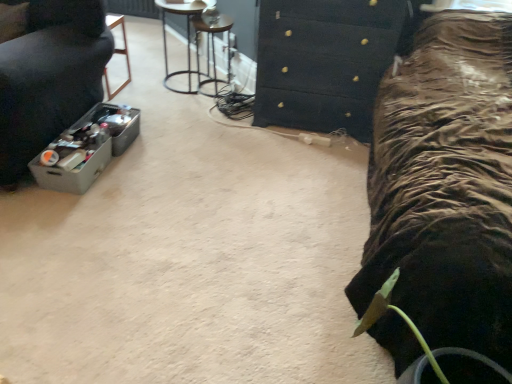
The image size is (512, 384). Describe the element at coordinates (214, 52) in the screenshot. I see `metallic wireframe stool at upper center` at that location.

Where is `metallic wireframe stool at upper center`? The height and width of the screenshot is (384, 512). metallic wireframe stool at upper center is located at coordinates (214, 52).

Where is `black textured chest of drawers at upper center`? The width and height of the screenshot is (512, 384). black textured chest of drawers at upper center is located at coordinates (326, 61).

Identify the location of gray plastic container at left, placed as the 2th furniture when sorted from right to left. (47, 75).

In order to click on the chest of drawers above the gray plastic container at left, placed as the 2th furniture when sorted from right to left (from the image's perspective) in this screenshot , I will do `click(326, 61)`.

Is black textured chest of drawers at upper center closer to the viewer compared to gray plastic container at left, which is the first furniture from left to right?

No, it is behind gray plastic container at left, which is the first furniture from left to right.

How different are the orientations of black textured chest of drawers at upper center and gray plastic container at left, the second furniture from the back, in degrees?

1.85 degrees.

Considering the sizes of objects black textured chest of drawers at upper center and gray plastic container at left, the second furniture from the back, in the image provided, who is thinner, black textured chest of drawers at upper center or gray plastic container at left, the second furniture from the back,?

black textured chest of drawers at upper center is thinner.

In the scene shown: Is black textured chest of drawers at upper center taller than metallic wire side table at upper center, which ranks as the second furniture in front-to-back order?

Yes, black textured chest of drawers at upper center is taller than metallic wire side table at upper center, which ranks as the second furniture in front-to-back order.

Would you consider black textured chest of drawers at upper center to be distant from metallic wire side table at upper center, the 1th furniture from the right?

black textured chest of drawers at upper center is far away from metallic wire side table at upper center, the 1th furniture from the right.

Considering the points (273, 75) and (176, 4), which point is behind, point (273, 75) or point (176, 4)?

Positioned behind is point (176, 4).

Where is `the chest of drawers located above the metallic wire side table at upper center, which ranks as the second furniture in front-to-back order (from a real-world perspective)`? The image size is (512, 384). the chest of drawers located above the metallic wire side table at upper center, which ranks as the second furniture in front-to-back order (from a real-world perspective) is located at coordinates (326, 61).

From the image's perspective, would you say black textured chest of drawers at upper center is shown under metallic wireframe stool at upper center?

Indeed, from the image's perspective, black textured chest of drawers at upper center is shown beneath metallic wireframe stool at upper center.

Which is farther from the camera, (308, 17) or (222, 90)?

Positioned behind is point (222, 90).

Is black textured chest of drawers at upper center bigger or smaller than metallic wireframe stool at upper center?

black textured chest of drawers at upper center is bigger than metallic wireframe stool at upper center.

Is metallic wireframe stool at upper center positioned far away from black textured chest of drawers at upper center?

No, metallic wireframe stool at upper center is not far away from black textured chest of drawers at upper center.

Consider the image. Can you tell me how much metallic wireframe stool at upper center and black textured chest of drawers at upper center differ in facing direction?

They differ by 0.709 degrees in their facing directions.

Based on the photo, between metallic wireframe stool at upper center and black textured chest of drawers at upper center, which one is positioned behind?

metallic wireframe stool at upper center.

Which of these two, metallic wireframe stool at upper center or black textured chest of drawers at upper center, is bigger?

Bigger between the two is black textured chest of drawers at upper center.

From a real-world perspective, is metallic wire side table at upper center, the 1th furniture from the right, positioned above or below metallic wireframe stool at upper center?

metallic wire side table at upper center, the 1th furniture from the right, is situated higher than metallic wireframe stool at upper center in the real world.

Identify the location of bar stool below the metallic wire side table at upper center, acting as the 1th furniture starting from the back (from a real-world perspective). (214, 52).

Considering the relative positions of metallic wire side table at upper center, which ranks as the second furniture in front-to-back order, and metallic wireframe stool at upper center in the image provided, is metallic wire side table at upper center, which ranks as the second furniture in front-to-back order, to the left of metallic wireframe stool at upper center from the viewer's perspective?

Indeed, metallic wire side table at upper center, which ranks as the second furniture in front-to-back order, is positioned on the left side of metallic wireframe stool at upper center.

Is metallic wireframe stool at upper center positioned with its back to metallic wire side table at upper center, the 1th furniture from the right?

No, metallic wireframe stool at upper center is not facing the opposite direction of metallic wire side table at upper center, the 1th furniture from the right.

Can you confirm if metallic wireframe stool at upper center is positioned to the right of metallic wire side table at upper center, the 1th furniture from the right?

Indeed, metallic wireframe stool at upper center is positioned on the right side of metallic wire side table at upper center, the 1th furniture from the right.

Considering the sizes of metallic wireframe stool at upper center and metallic wire side table at upper center, acting as the 1th furniture starting from the back, in the image, is metallic wireframe stool at upper center wider or thinner than metallic wire side table at upper center, acting as the 1th furniture starting from the back,?

metallic wireframe stool at upper center is wider than metallic wire side table at upper center, acting as the 1th furniture starting from the back.

Is metallic wire side table at upper center, the 1th furniture from the right, completely or partially inside metallic wireframe stool at upper center?

Yes, metallic wire side table at upper center, the 1th furniture from the right, is surrounded by metallic wireframe stool at upper center.

Which of these two, metallic wireframe stool at upper center or gray plastic container at left, which is the first furniture from left to right, is bigger?

With larger size is gray plastic container at left, which is the first furniture from left to right.

Is metallic wireframe stool at upper center further to the viewer compared to gray plastic container at left, placed as the 2th furniture when sorted from right to left?

Yes, it is behind gray plastic container at left, placed as the 2th furniture when sorted from right to left.

Is metallic wireframe stool at upper center in contact with gray plastic container at left, the second furniture from the back?

No, metallic wireframe stool at upper center is not in contact with gray plastic container at left, the second furniture from the back.

Measure the distance from metallic wireframe stool at upper center to gray plastic container at left, the second furniture from the back.

metallic wireframe stool at upper center is 1.03 meters from gray plastic container at left, the second furniture from the back.

Find the location of a particular element. The width and height of the screenshot is (512, 384). chest of drawers below the gray plastic container at left, which is the first furniture from left to right (from a real-world perspective) is located at coordinates (326, 61).

Where is `chest of drawers above the metallic wire side table at upper center, the 1th furniture from the right (from a real-world perspective)`? chest of drawers above the metallic wire side table at upper center, the 1th furniture from the right (from a real-world perspective) is located at coordinates pos(326,61).

Looking at the image, which one is located further to black textured chest of drawers at upper center, metallic wire side table at upper center, the 1th furniture from the right, or gray plastic container at left, the second furniture from the back?

gray plastic container at left, the second furniture from the back, is positioned further to the anchor black textured chest of drawers at upper center.

Looking at the image, which one is located closer to gray plastic container at left, the second furniture from the back, metallic wireframe stool at upper center or metallic wire side table at upper center, arranged as the 2th furniture when viewed from the left?

metallic wireframe stool at upper center is positioned closer to the anchor gray plastic container at left, the second furniture from the back.

When comparing their distances from metallic wire side table at upper center, the 1th furniture from the right, does black textured chest of drawers at upper center or gray plastic container at left, the second furniture from the back, seem closer?

Among the two, black textured chest of drawers at upper center is located nearer to metallic wire side table at upper center, the 1th furniture from the right.

Looking at the image, which one is located closer to metallic wireframe stool at upper center, metallic wire side table at upper center, acting as the 1th furniture starting from the back, or gray plastic container at left, which ranks as the first furniture in front-to-back order?

Based on the image, metallic wire side table at upper center, acting as the 1th furniture starting from the back, appears to be nearer to metallic wireframe stool at upper center.

Looking at this image, based on their spatial positions, is metallic wire side table at upper center, arranged as the 2th furniture when viewed from the left, or metallic wireframe stool at upper center further from gray plastic container at left, which is the first furniture from left to right?

Among the two, metallic wire side table at upper center, arranged as the 2th furniture when viewed from the left, is located further to gray plastic container at left, which is the first furniture from left to right.

Considering their positions, is gray plastic container at left, which ranks as the first furniture in front-to-back order, positioned further to black textured chest of drawers at upper center than metallic wire side table at upper center, arranged as the 2th furniture when viewed from the left?

gray plastic container at left, which ranks as the first furniture in front-to-back order, lies further to black textured chest of drawers at upper center than the other object.

Estimate the real-world distances between objects in this image. Which object is closer to metallic wireframe stool at upper center, metallic wire side table at upper center, arranged as the 2th furniture when viewed from the left, or black textured chest of drawers at upper center?

metallic wire side table at upper center, arranged as the 2th furniture when viewed from the left.

Looking at this image, based on their spatial positions, is gray plastic container at left, the second furniture from the back, or metallic wire side table at upper center, which ranks as the second furniture in front-to-back order, further from metallic wireframe stool at upper center?

gray plastic container at left, the second furniture from the back, is positioned further to the anchor metallic wireframe stool at upper center.

Image resolution: width=512 pixels, height=384 pixels. Find the location of `furniture between gray plastic container at left, which ranks as the first furniture in front-to-back order, and metallic wireframe stool at upper center from front to back`. furniture between gray plastic container at left, which ranks as the first furniture in front-to-back order, and metallic wireframe stool at upper center from front to back is located at coordinates (187, 38).

Where is `bar stool between metallic wire side table at upper center, which ranks as the second furniture in front-to-back order, and black textured chest of drawers at upper center from left to right`? The height and width of the screenshot is (384, 512). bar stool between metallic wire side table at upper center, which ranks as the second furniture in front-to-back order, and black textured chest of drawers at upper center from left to right is located at coordinates tap(214, 52).

Locate an element on the screen. The height and width of the screenshot is (384, 512). bar stool located between gray plastic container at left, the second furniture from the back, and black textured chest of drawers at upper center in the left-right direction is located at coordinates (214, 52).

This screenshot has height=384, width=512. I want to click on furniture located between gray plastic container at left, placed as the 2th furniture when sorted from right to left, and black textured chest of drawers at upper center in the left-right direction, so click(x=187, y=38).